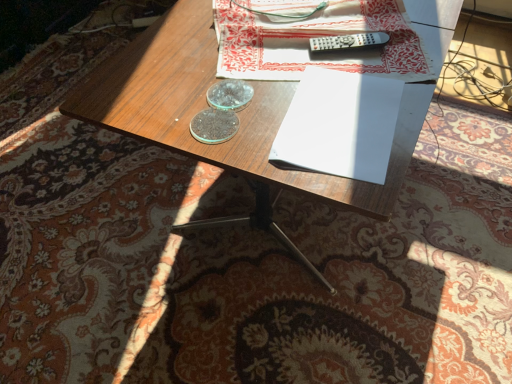
The image size is (512, 384). What are the coordinates of `vacant space to the left of white paper at upper center` in the screenshot? It's located at (156, 67).